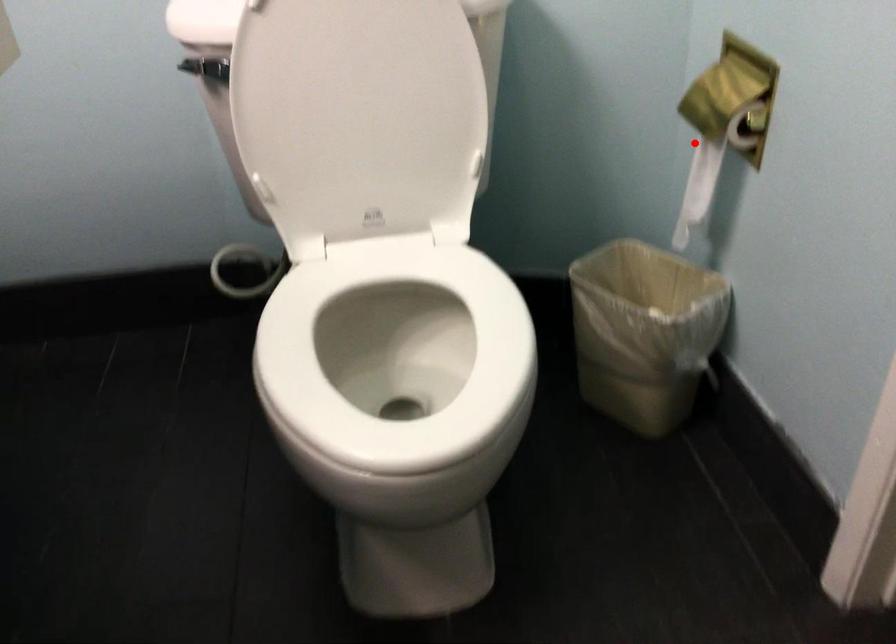
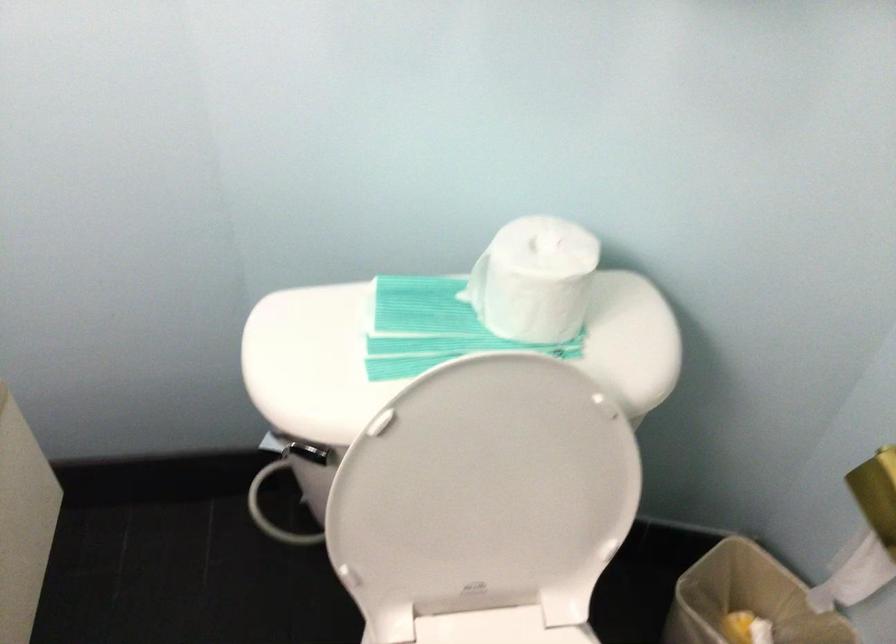
Question: I am providing you with two images of the same scene from different viewpoints. A red point is marked on the first image. Is the red point's position out of view in image 2?

Choices:
 (A) Yes
 (B) No

Answer: (B)